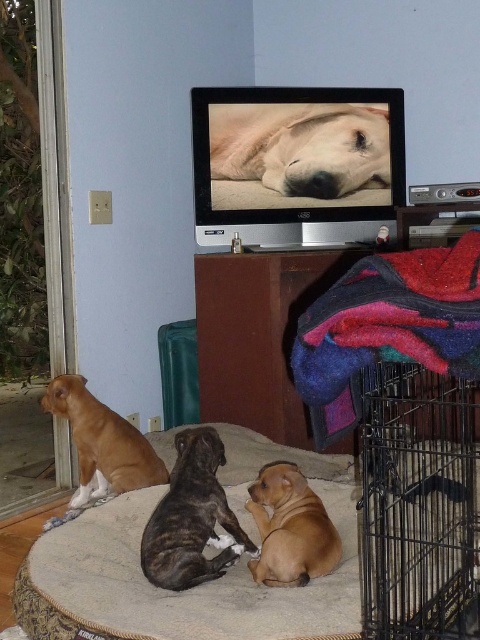
Question: Can you confirm if carpeted pet bed at lower center is positioned below matte brown dog at left?

Choices:
 (A) yes
 (B) no

Answer: (A)

Question: Which of the following is the farthest from the observer?

Choices:
 (A) brindle fur dog at center
 (B) golden fur dog at center

Answer: (B)

Question: Observing the image, what is the correct spatial positioning of carpeted pet bed at lower center in reference to matte brown dog at left?

Choices:
 (A) left
 (B) right

Answer: (B)

Question: Which point is closer to the camera?

Choices:
 (A) (63, 404)
 (B) (259, 176)
 (C) (450, 422)
 (D) (282, 470)

Answer: (D)

Question: Does brindle fur dog at center come in front of matte brown dog at center?

Choices:
 (A) yes
 (B) no

Answer: (B)

Question: Which point is closer to the camera?

Choices:
 (A) (251, 492)
 (B) (177, 579)

Answer: (B)